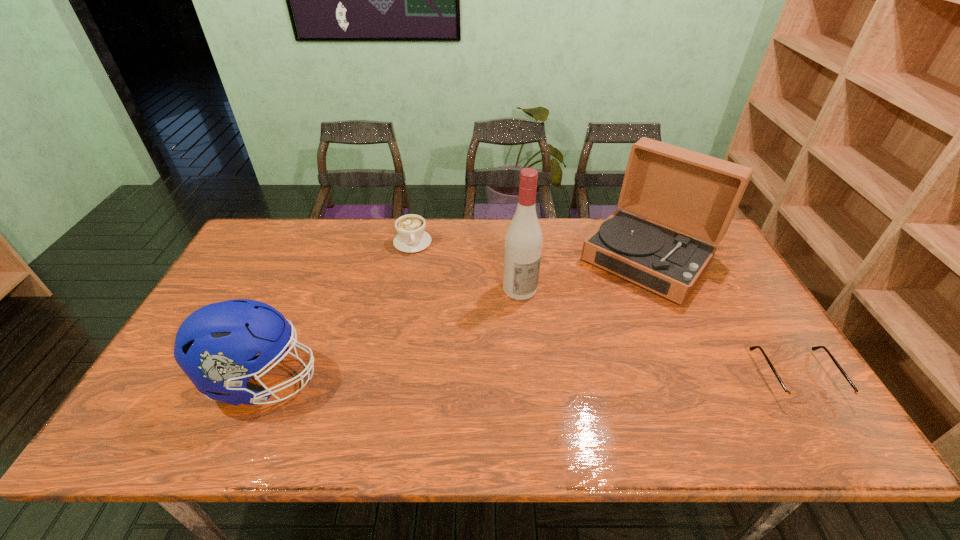
The width and height of the screenshot is (960, 540). What are the coordinates of `free space at the right edge` in the screenshot? It's located at (713, 263).

This screenshot has width=960, height=540. In the image, there is a desktop. In order to click on free region at the far left corner in this screenshot , I will do `click(273, 240)`.

Identify the location of vacant space at the near right corner. The width and height of the screenshot is (960, 540). (802, 387).

Find the location of a particular element. The width and height of the screenshot is (960, 540). vacant region between the spectacles and the alcohol is located at coordinates (658, 333).

At what (x,y) coordinates should I click in order to perform the action: click on blank region between the cappuccino and the football helmet. Please return your answer as a coordinate pair (x, y). The width and height of the screenshot is (960, 540). Looking at the image, I should click on (338, 311).

Locate an element on the screen. Image resolution: width=960 pixels, height=540 pixels. vacant area that lies between the football helmet and the fourth tallest object is located at coordinates (338, 311).

Locate an element on the screen. free space between the spectacles and the phonograph record is located at coordinates (722, 318).

Find the location of `unoccupied position between the spectacles and the tallest object`. unoccupied position between the spectacles and the tallest object is located at coordinates (658, 333).

Locate an element on the screen. Image resolution: width=960 pixels, height=540 pixels. vacant space that is in between the cappuccino and the alcohol is located at coordinates (467, 266).

This screenshot has height=540, width=960. What are the coordinates of `vacant space that is in between the fourth object from right to left and the shortest object` in the screenshot? It's located at (604, 310).